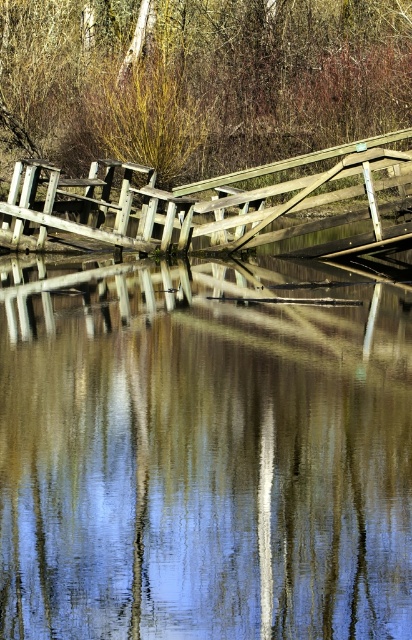
Can you confirm if transparent water at center is smaller than brown wood tree at upper center?

Yes.

How distant is transparent water at center from brown wood tree at upper center?

16.54 meters

What do you see at coordinates (201, 460) in the screenshot? This screenshot has height=640, width=412. I see `transparent water at center` at bounding box center [201, 460].

Where is `transparent water at center`? The height and width of the screenshot is (640, 412). transparent water at center is located at coordinates (201, 460).